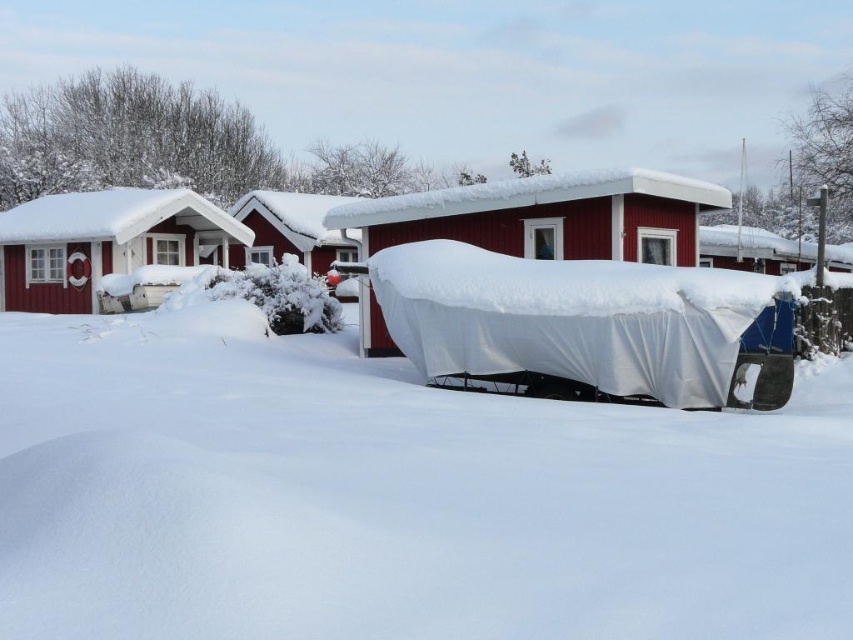
You are standing at the point marked as point (x=548, y=216) in the winter scene. What object is directly beneath your feet?

The object directly beneath your feet at point (x=548, y=216) is the matte red boat at center.

You are a delivery person needing to reach the matte red wooden hut at left from the matte red boat at center. Given that your delivery cart can only move within a 20 feet radius, can you reach the destination?

The matte red boat at center is 33.78 feet away from the matte red wooden hut at left. Since the delivery cart can only move within a 20 feet radius, you cannot reach the destination as the distance exceeds the cart

You are planning to move the matte red boat at center to a storage area located behind the matte red wooden hut at left. Based on the scene description, can you determine if the boat will fit through the space between the hut and the nearest snowdrift? Please explain your reasoning.

The matte red boat at center is positioned under the matte red wooden hut at left, so moving it behind the hut would require space between the hut and the nearest snowdrift. However, the scene description does not provide specific measurements or spatial dimensions between the hut and the snowdrift. Without this information, it is impossible to determine if the boat will fit through that space.